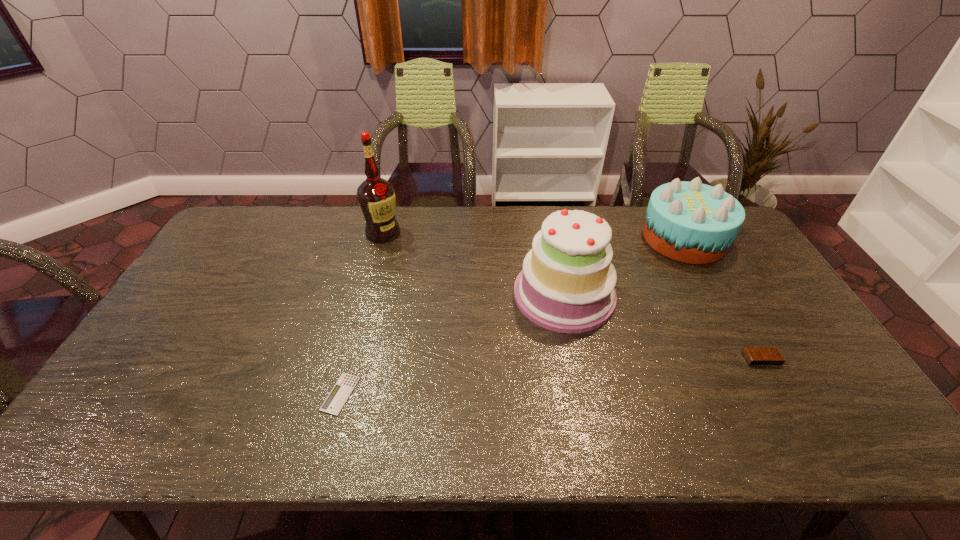
Where is `vacant area that lies between the taller cake and the shorter cake`? The image size is (960, 540). vacant area that lies between the taller cake and the shorter cake is located at coordinates (624, 266).

Image resolution: width=960 pixels, height=540 pixels. Identify the location of vacant region between the calculator and the third shortest object. (513, 316).

Find the location of a particular element. object that is the third closest one to the nearest object is located at coordinates (690, 222).

Locate which object is the fourth closest to the fourth tallest object. Please provide its 2D coordinates. Your answer should be formatted as a tuple, i.e. [(x, y)], where the tuple contains the x and y coordinates of a point satisfying the conditions above.

[(376, 196)]

This screenshot has height=540, width=960. In order to click on free space that satisfies the following two spatial constraints: 1. on the back side of the third shortest object; 2. on the right side of the left cake in this screenshot , I will do `click(553, 238)`.

This screenshot has width=960, height=540. What are the coordinates of `free spot that satisfies the following two spatial constraints: 1. on the label of the alcohol; 2. on the left side of the taller cake` in the screenshot? It's located at (367, 294).